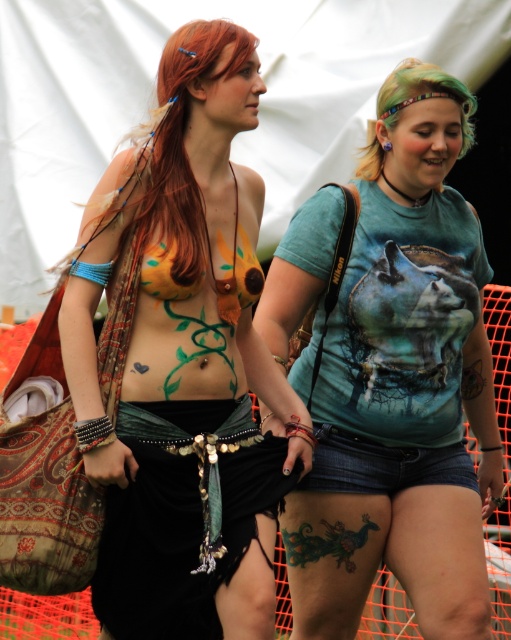
Question: Is matte teal t-shirt at center to the right of green matte vine at center from the viewer's perspective?

Choices:
 (A) yes
 (B) no

Answer: (A)

Question: Which of the following is the farthest from the observer?

Choices:
 (A) teal printed t-shirt at center
 (B) blue ink dragon at lower center
 (C) blonde hair at upper center

Answer: (B)

Question: Can you confirm if black fabric skirt at center is wider than blonde hair at upper center?

Choices:
 (A) yes
 (B) no

Answer: (A)

Question: Which of the following is the closest to the observer?

Choices:
 (A) (89, 378)
 (B) (489, 380)
 (C) (239, 433)

Answer: (A)

Question: Does teal printed t-shirt at center appear on the right side of blonde hair at upper center?

Choices:
 (A) no
 (B) yes

Answer: (B)

Question: Which point is farther to the camera?

Choices:
 (A) (387, 100)
 (B) (386, 400)
 (C) (172, 209)

Answer: (B)